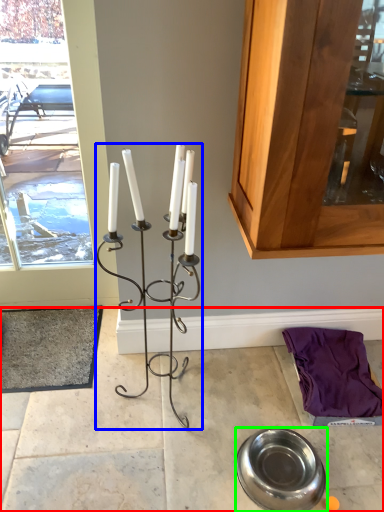
Question: Which object is the farthest from concrete (highlighted by a red box)? Choose among these: candle holder (highlighted by a blue box) or tableware (highlighted by a green box).

Choices:
 (A) candle holder
 (B) tableware

Answer: (A)